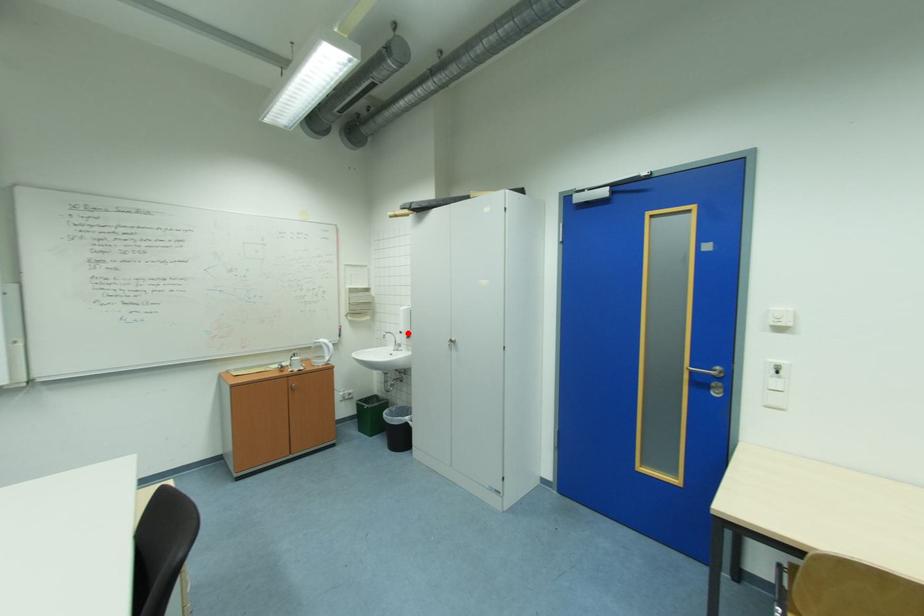
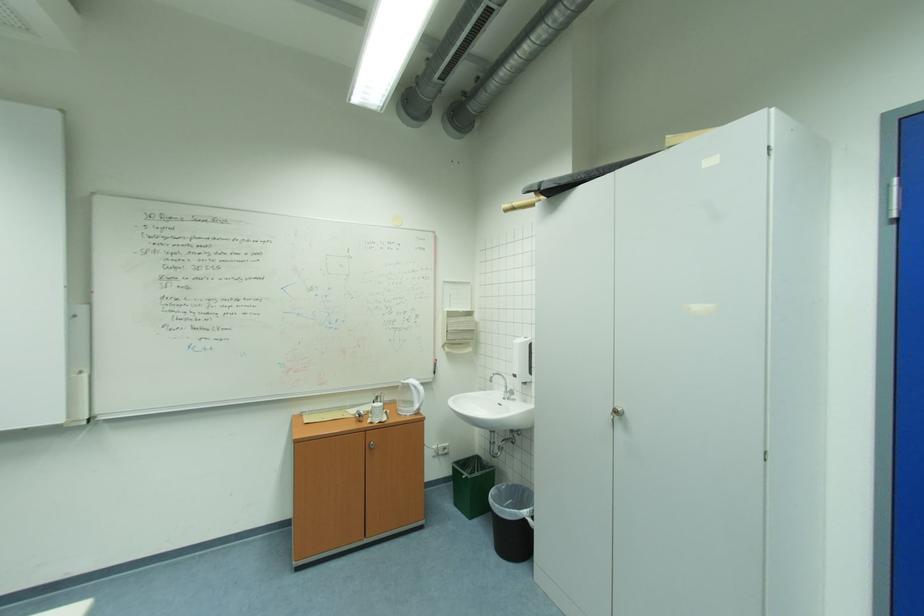
In the second image, find the point that corresponds to the highlighted location in the first image.

(523, 377)